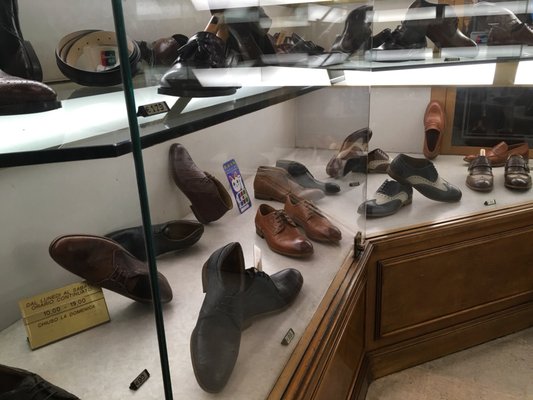
Image resolution: width=533 pixels, height=400 pixels. I want to click on glass frame, so click(148, 221), click(126, 101).